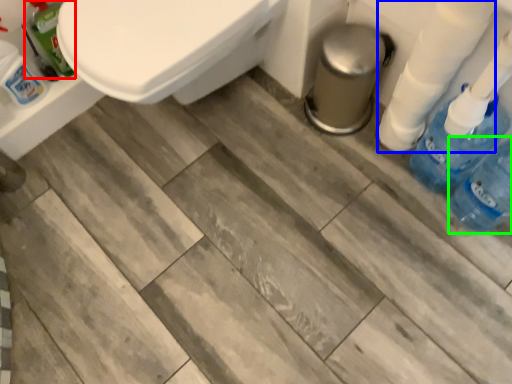
Question: Considering the real-world distances, which object is closest to cleaning product (highlighted by a red box)? toilet paper (highlighted by a blue box) or bottle (highlighted by a green box).

Choices:
 (A) toilet paper
 (B) bottle

Answer: (A)